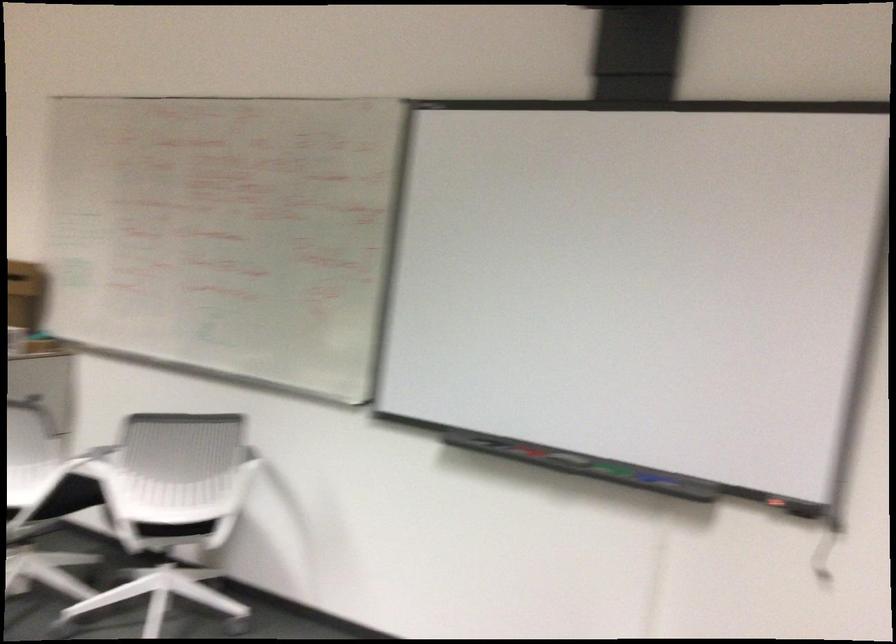
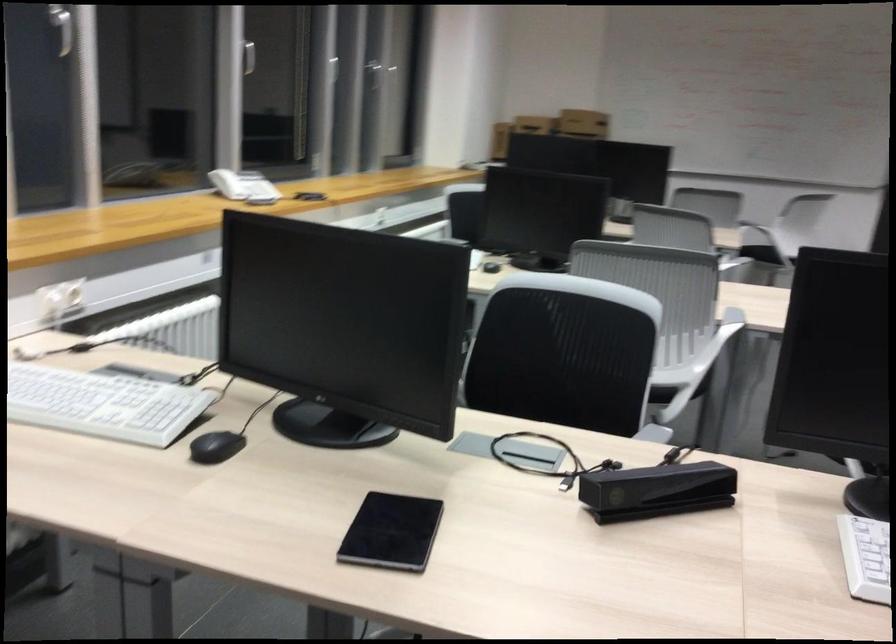
Question: I am providing you with two images of the same scene from different viewpoints. After the viewpoint changes to image2, which objects are now occluded?

Choices:
 (A) round drawer knob
 (B) black computer mouse
 (C) telephone handset
 (D) chair sitting surface

Answer: (D)